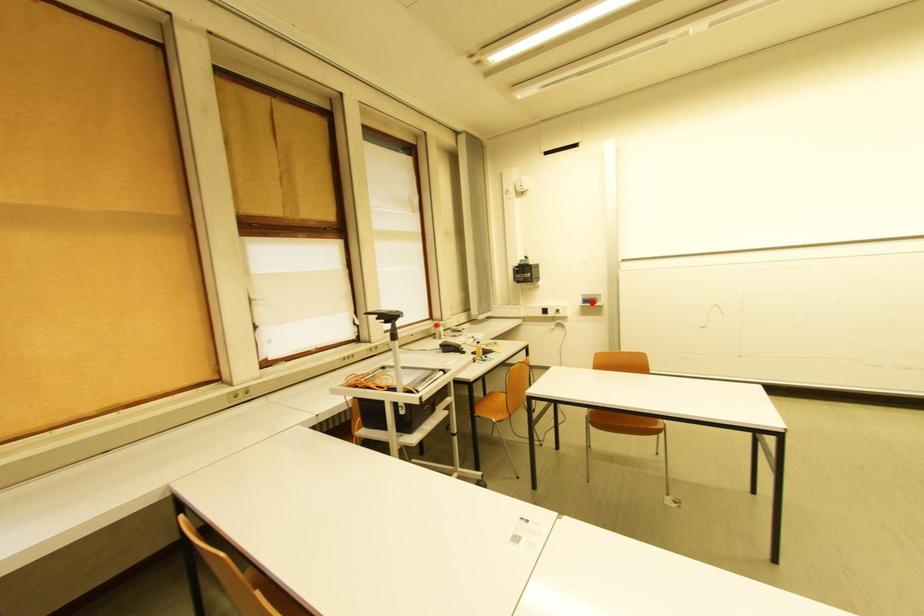
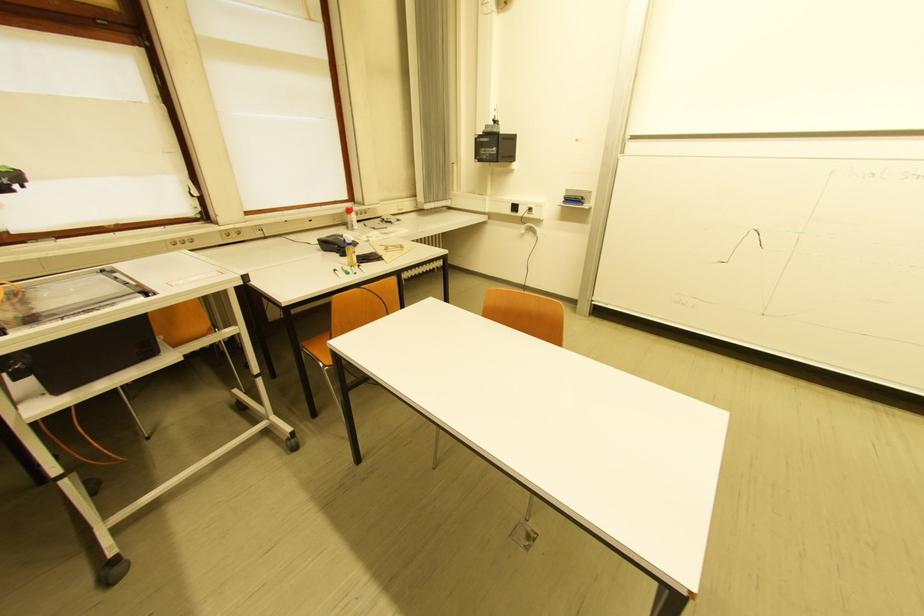
Question: A red point is marked in image1. In image2, is the corresponding 3D point closer to the camera or farther? Reply with the corresponding letter.

Choices:
 (A) The corresponding 3D point is closer.
 (B) The corresponding 3D point is farther.

Answer: (A)